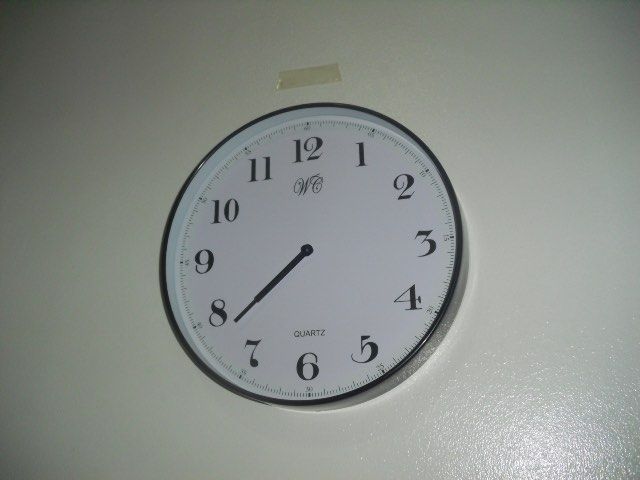
What are the coordinates of `center of clock` in the screenshot? It's located at (305, 249).